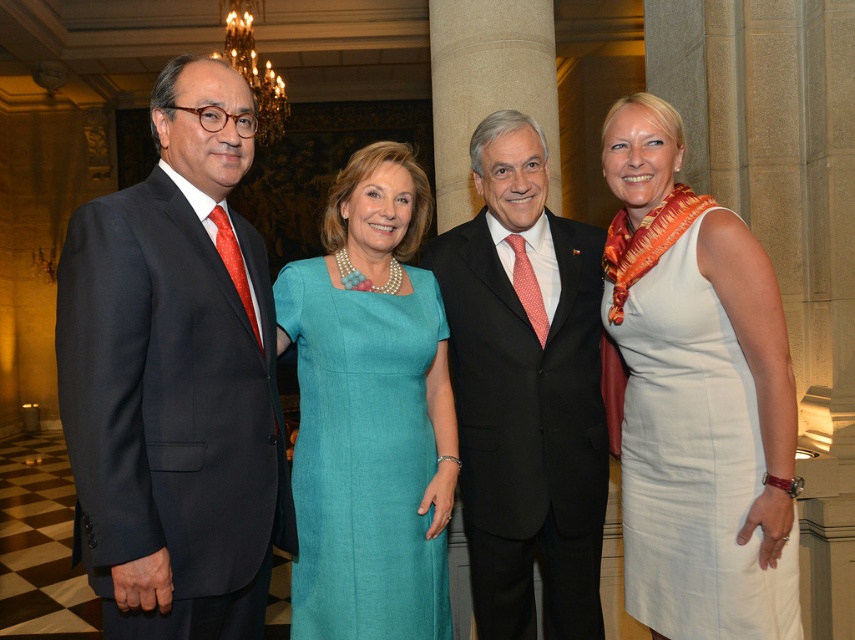
You are a photographer adjusting the lighting for a group photo. You need to ensure that the matte black suit at left and the white satin dress at right are both well lit. Considering their widths, which object requires a wider light beam to cover its entire width?

The white satin dress at right requires a wider light beam because it is wider than the matte black suit at left.

You are standing in the grand hall and want to locate the black suit at center. According to the coordinates provided, where would you find it?

The black suit at center is located at coordinates point (x=526, y=390).